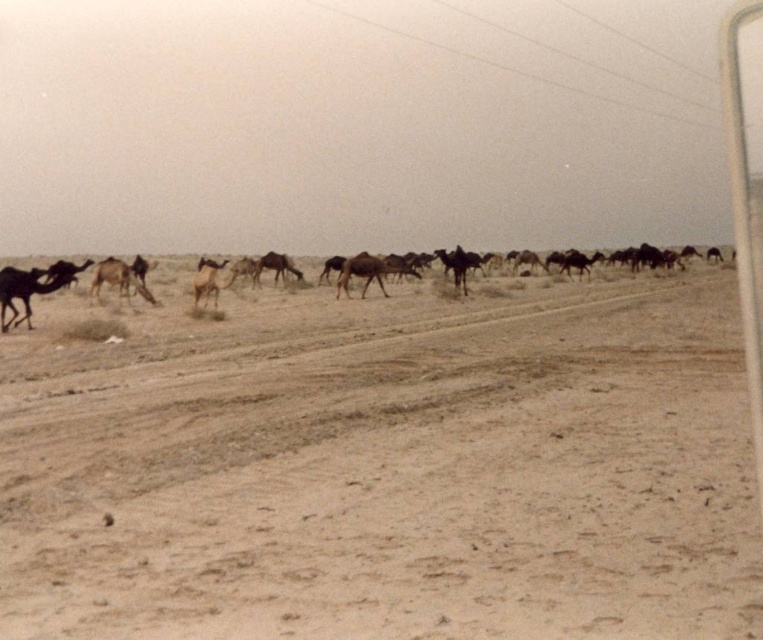
Question: Is brown fuzzy camel at center-left further to camera compared to brown matte camel at center?

Choices:
 (A) no
 (B) yes

Answer: (A)

Question: Among these points, which one is farthest from the camera?

Choices:
 (A) (118, 289)
 (B) (272, 253)
 (C) (72, 268)

Answer: (B)

Question: Can you confirm if brown matte camel at left is positioned to the right of brown matte camel at center?

Choices:
 (A) yes
 (B) no

Answer: (B)

Question: Which point is closer to the camera?

Choices:
 (A) brown matte camel at center
 (B) brown fuzzy camel at center-left
 (C) brown sandy dirt field at center
 (D) brown matte camel at left

Answer: (C)

Question: Is brown sandy dirt field at center smaller than brown matte camel at center?

Choices:
 (A) yes
 (B) no

Answer: (B)

Question: Which point appears farthest from the camera in this image?

Choices:
 (A) (124, 282)
 (B) (13, 308)

Answer: (A)